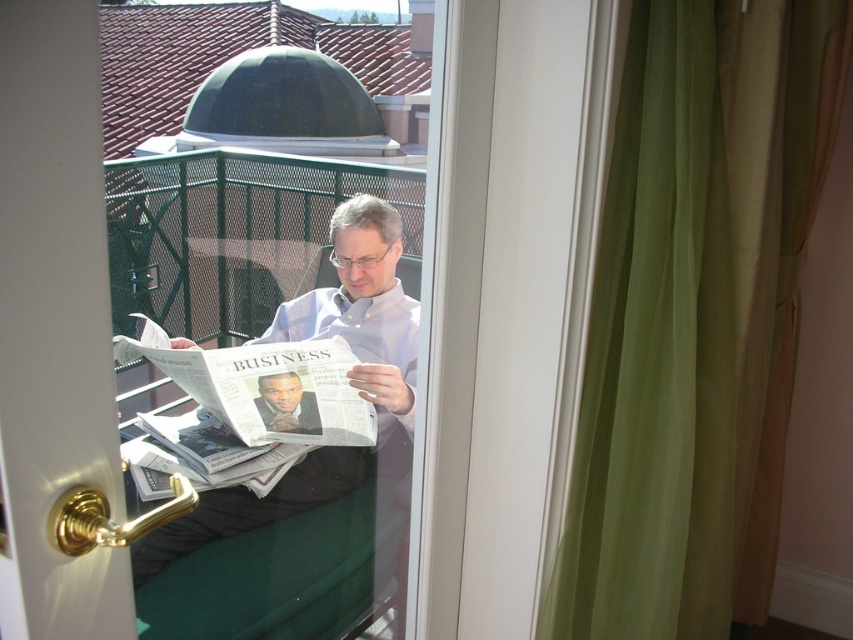
You are a photographer trying to capture the matte black newspaper at center while ensuring the green fabric curtain at right doesn not block the view. Based on their heights, can you position yourself lower to achieve this?

The green fabric curtain at right is taller than the matte black newspaper at center. Positioning yourself lower might help focus on the newspaper while minimizing the curtain obstruction, as the curtain is taller and could be seen less from below.

You are standing inside the room looking at the balcony. There are two points marked in the image. Which point is closer to you, point [355,312] or point [265,381]?

Point [355,312] is further to the viewer than point [265,381]. Therefore, point [265,381] is closer to you.